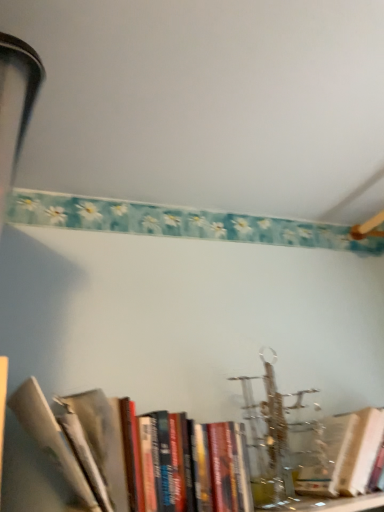
Describe the element at coordinates (339, 454) in the screenshot. I see `hardcover book at center, which appears as the 2th book when viewed from the left` at that location.

I want to click on hardcover book at center, the first book viewed from the right, so click(339, 454).

What is the approximate width of hardcover books at lower left, which is the second book from right to left?

hardcover books at lower left, which is the second book from right to left, is 10.13 inches in width.

This screenshot has width=384, height=512. Describe the element at coordinates (51, 438) in the screenshot. I see `hardcover books at lower left, acting as the first book starting from the left` at that location.

You are a GUI agent. You are given a task and a screenshot of the screen. Output one action in this format:
    pyautogui.click(x=<x>, y=<y>)
    Task: Click on the hardcover books at lower left, acting as the first book starting from the left
    The image size is (384, 512).
    Given the screenshot: What is the action you would take?
    pyautogui.click(x=51, y=438)

You are a GUI agent. You are given a task and a screenshot of the screen. Output one action in this format:
    pyautogui.click(x=<x>, y=<y>)
    Task: Click on the hardcover book at center, which appears as the 2th book when viewed from the left
    This screenshot has height=512, width=384.
    Given the screenshot: What is the action you would take?
    pyautogui.click(x=339, y=454)

Does hardcover book at center, the first book viewed from the right, appear on the right side of hardcover books at lower left, acting as the first book starting from the left?

Correct, you'll find hardcover book at center, the first book viewed from the right, to the right of hardcover books at lower left, acting as the first book starting from the left.

Which object is more forward, hardcover book at center, the first book viewed from the right, or hardcover books at lower left, acting as the first book starting from the left?

hardcover books at lower left, acting as the first book starting from the left, is more forward.

Considering the points (308, 445) and (43, 429), which point is behind, point (308, 445) or point (43, 429)?

The point (308, 445) is behind.

From the image's perspective, is hardcover book at center, the first book viewed from the right, positioned above or below hardcover books at lower left, which is the second book from right to left?

Based on their image positions, hardcover book at center, the first book viewed from the right, is located beneath hardcover books at lower left, which is the second book from right to left.

From a real-world perspective, is hardcover book at center, which appears as the 2th book when viewed from the left, physically above hardcover books at lower left, which is the second book from right to left?

No, from a real-world perspective, hardcover book at center, which appears as the 2th book when viewed from the left, is not above hardcover books at lower left, which is the second book from right to left.

Is hardcover book at center, which appears as the 2th book when viewed from the left, wider than hardcover books at lower left, acting as the first book starting from the left?

Incorrect, the width of hardcover book at center, which appears as the 2th book when viewed from the left, does not surpass that of hardcover books at lower left, acting as the first book starting from the left.

Between hardcover book at center, which appears as the 2th book when viewed from the left, and hardcover books at lower left, acting as the first book starting from the left, which one has less height?

With less height is hardcover book at center, which appears as the 2th book when viewed from the left.

Considering the relative sizes of hardcover book at center, which appears as the 2th book when viewed from the left, and hardcover books at lower left, which is the second book from right to left, in the image provided, is hardcover book at center, which appears as the 2th book when viewed from the left, bigger than hardcover books at lower left, which is the second book from right to left,?

No.

Is hardcover books at lower left, acting as the first book starting from the left, located within hardcover book at center, which appears as the 2th book when viewed from the left?

No.

Is hardcover book at center, the first book viewed from the right, next to hardcover books at lower left, which is the second book from right to left?

No, hardcover book at center, the first book viewed from the right, is not making contact with hardcover books at lower left, which is the second book from right to left.

Does hardcover book at center, which appears as the 2th book when viewed from the left, turn towards hardcover books at lower left, acting as the first book starting from the left?

No, hardcover book at center, which appears as the 2th book when viewed from the left, is not aimed at hardcover books at lower left, acting as the first book starting from the left.

The image size is (384, 512). I want to click on book below the hardcover books at lower left, which is the second book from right to left (from a real-world perspective), so click(x=339, y=454).

Which is more to the left, hardcover books at lower left, which is the second book from right to left, or hardcover book at center, which appears as the 2th book when viewed from the left?

hardcover books at lower left, which is the second book from right to left.

Considering their positions, is hardcover books at lower left, which is the second book from right to left, located in front of or behind hardcover book at center, which appears as the 2th book when viewed from the left?

In the image, hardcover books at lower left, which is the second book from right to left, appears in front of hardcover book at center, which appears as the 2th book when viewed from the left.

Is point (121, 447) closer to viewer compared to point (332, 489)?

That is True.

From the image's perspective, which one is positioned higher, hardcover books at lower left, which is the second book from right to left, or hardcover book at center, the first book viewed from the right?

hardcover books at lower left, which is the second book from right to left, appears higher in the image.

From a real-world perspective, which is physically below, hardcover books at lower left, acting as the first book starting from the left, or hardcover book at center, which appears as the 2th book when viewed from the left?

In real-world perspective, hardcover book at center, which appears as the 2th book when viewed from the left, is lower.

Between hardcover books at lower left, acting as the first book starting from the left, and hardcover book at center, the first book viewed from the right, which one has smaller width?

With smaller width is hardcover book at center, the first book viewed from the right.

Between hardcover books at lower left, acting as the first book starting from the left, and hardcover book at center, which appears as the 2th book when viewed from the left, which one has more height?

Standing taller between the two is hardcover books at lower left, acting as the first book starting from the left.

Between hardcover books at lower left, which is the second book from right to left, and hardcover book at center, the first book viewed from the right, which one has larger size?

hardcover books at lower left, which is the second book from right to left, is bigger.

Is hardcover books at lower left, which is the second book from right to left, inside the boundaries of hardcover book at center, which appears as the 2th book when viewed from the left, or outside?

hardcover books at lower left, which is the second book from right to left, exists outside the volume of hardcover book at center, which appears as the 2th book when viewed from the left.

Based on the photo, are hardcover books at lower left, acting as the first book starting from the left, and hardcover book at center, which appears as the 2th book when viewed from the left, making contact?

No, hardcover books at lower left, acting as the first book starting from the left, is not with hardcover book at center, which appears as the 2th book when viewed from the left.

Is hardcover books at lower left, acting as the first book starting from the left, aimed at hardcover book at center, which appears as the 2th book when viewed from the left?

No, hardcover books at lower left, acting as the first book starting from the left, does not turn towards hardcover book at center, which appears as the 2th book when viewed from the left.

Consider the image. Can you tell me how much hardcover books at lower left, which is the second book from right to left, and hardcover book at center, the first book viewed from the right, differ in facing direction?

hardcover books at lower left, which is the second book from right to left, and hardcover book at center, the first book viewed from the right, are facing 0.000263 degrees away from each other.

How far apart are hardcover books at lower left, acting as the first book starting from the left, and hardcover book at center, which appears as the 2th book when viewed from the left?

A distance of 6.61 inches exists between hardcover books at lower left, acting as the first book starting from the left, and hardcover book at center, which appears as the 2th book when viewed from the left.

Find the location of a particular element. Image resolution: width=384 pixels, height=512 pixels. book above the hardcover book at center, the first book viewed from the right (from a real-world perspective) is located at coordinates (51, 438).

Where is `book that appears on the right of hardcover books at lower left, which is the second book from right to left`? The height and width of the screenshot is (512, 384). book that appears on the right of hardcover books at lower left, which is the second book from right to left is located at coordinates (339, 454).

Identify the location of book behind the hardcover books at lower left, which is the second book from right to left. (339, 454).